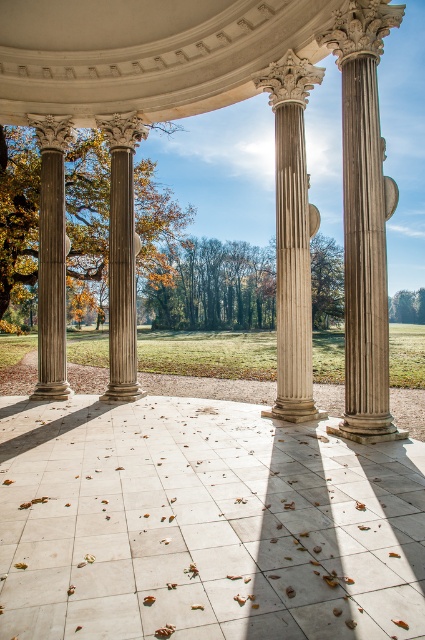
Question: Is white marble column at center below smooth gray column at center?

Choices:
 (A) yes
 (B) no

Answer: (A)

Question: Which of the following is the farthest from the observer?

Choices:
 (A) pos(371,99)
 (B) pos(302,93)
 (C) pos(51,236)
 (D) pos(95,276)

Answer: (D)

Question: Is white marble column at center smaller than smooth gray column at center?

Choices:
 (A) yes
 (B) no

Answer: (B)

Question: Is marble column at right closer to the viewer compared to green leafy tree at center?

Choices:
 (A) yes
 (B) no

Answer: (A)

Question: Which point appears closest to the camera in this image?

Choices:
 (A) (93, 218)
 (B) (121, 236)

Answer: (B)

Question: Which of the following is the closest to the observer?

Choices:
 (A) (302, 147)
 (B) (118, 292)

Answer: (A)